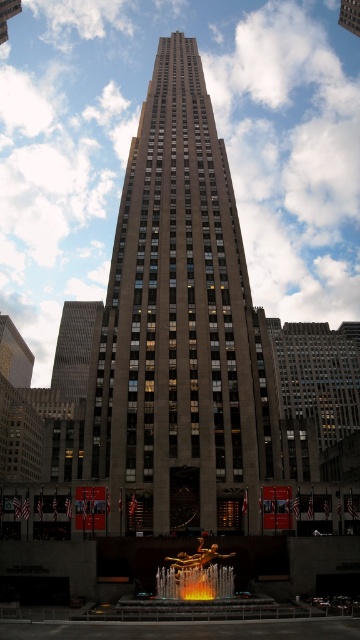
Question: Where is brown stone tower at center located in relation to dark gray stone tower at left in the image?

Choices:
 (A) left
 (B) right

Answer: (B)

Question: Can you confirm if brown stone tower at center is thinner than dark gray stone tower at left?

Choices:
 (A) no
 (B) yes

Answer: (B)

Question: Which point appears farthest from the camera in this image?

Choices:
 (A) (61, 310)
 (B) (231, 392)

Answer: (A)

Question: Which object appears farthest from the camera in this image?

Choices:
 (A) dark gray stone tower at left
 (B) brown stone tower at center

Answer: (A)

Question: Is brown stone tower at center wider than dark gray stone tower at left?

Choices:
 (A) yes
 (B) no

Answer: (B)